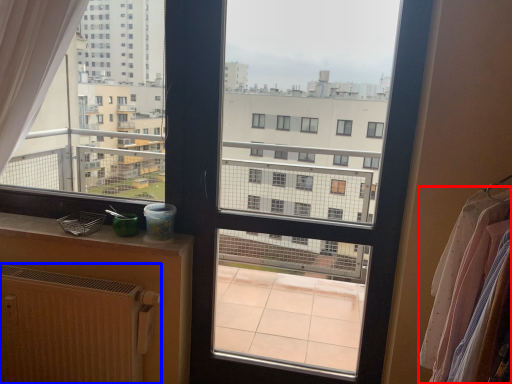
Question: Which of the following is the farthest to the observer, clothing (highlighted by a red box) or radiator (highlighted by a blue box)?

Choices:
 (A) clothing
 (B) radiator

Answer: (B)